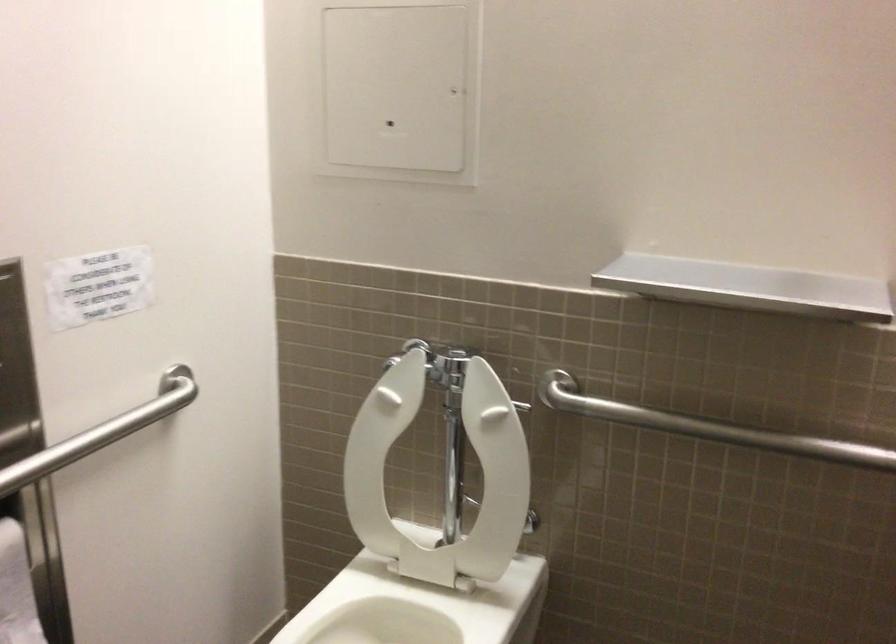
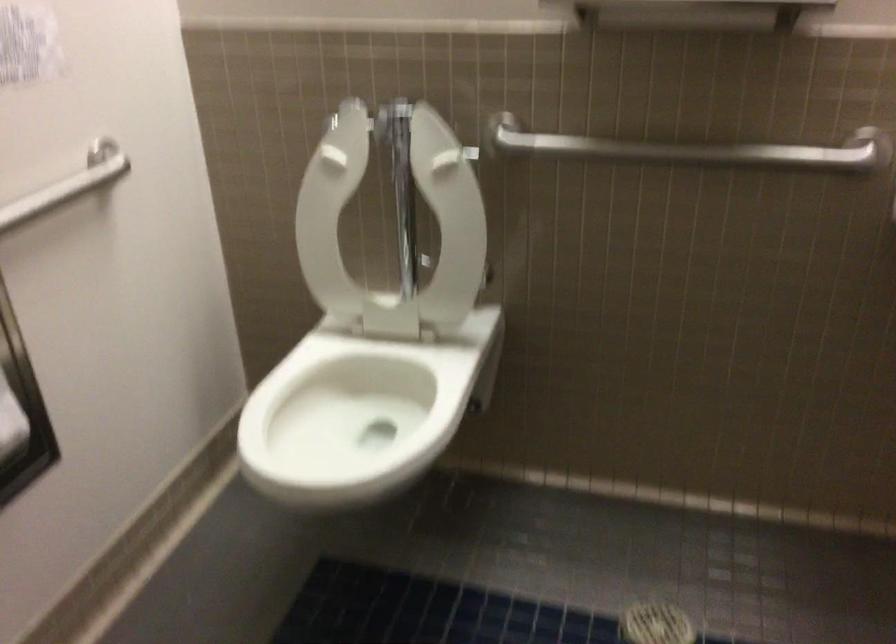
Question: In a continuous first-person perspective shot, in which direction is the camera moving?

Choices:
 (A) Left
 (B) Right
 (C) Forward
 (D) Backward

Answer: (A)